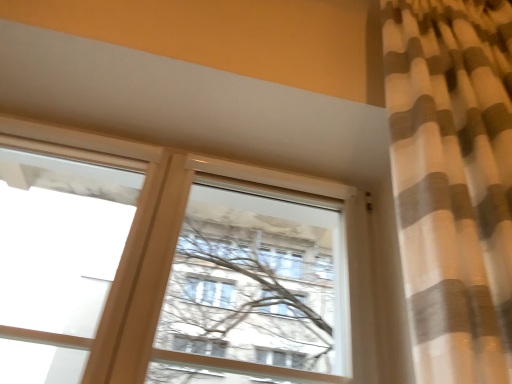
Question: From the image's perspective, is white matte window at center, which is counted as the second window, starting from the left, located above or below transparent glass window at upper left, which is the 1th window in left-to-right order?

Choices:
 (A) below
 (B) above

Answer: (A)

Question: Is white matte window at center, arranged as the first window when viewed from the right, inside the boundaries of transparent glass window at upper left, the second window from the right, or outside?

Choices:
 (A) outside
 (B) inside

Answer: (A)

Question: Based on their positions, is white matte window at center, arranged as the first window when viewed from the right, located to the left or right of transparent glass window at upper left, which is the 1th window in left-to-right order?

Choices:
 (A) right
 (B) left

Answer: (A)

Question: Is point (52, 208) positioned closer to the camera than point (165, 362)?

Choices:
 (A) closer
 (B) farther

Answer: (A)

Question: Considering the positions of transparent glass window at upper left, which is the 1th window in left-to-right order, and white matte window at center, which is counted as the second window, starting from the left, in the image, is transparent glass window at upper left, which is the 1th window in left-to-right order, wider or thinner than white matte window at center, which is counted as the second window, starting from the left,?

Choices:
 (A) thin
 (B) wide

Answer: (A)

Question: From the image's perspective, is transparent glass window at upper left, the second window from the right, above or below white matte window at center, which is counted as the second window, starting from the left?

Choices:
 (A) below
 (B) above

Answer: (B)

Question: Considering their positions, is transparent glass window at upper left, the second window from the right, located in front of or behind white matte window at center, which is counted as the second window, starting from the left?

Choices:
 (A) front
 (B) behind

Answer: (A)